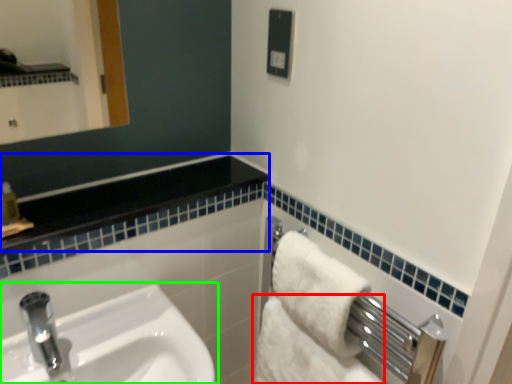
Question: Which is nearer to the bath towel (highlighted by a red box)? balustrade (highlighted by a blue box) or sink (highlighted by a green box).

Choices:
 (A) balustrade
 (B) sink

Answer: (B)